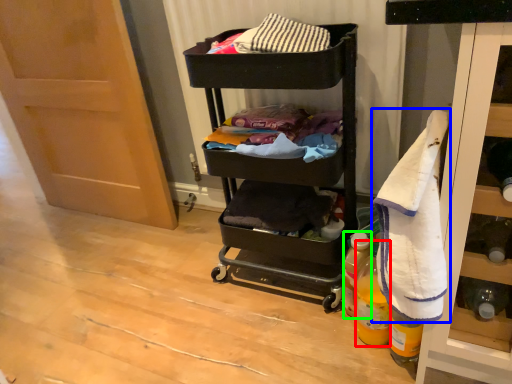
Question: Which object is the closest to the bottle (highlighted by a red box)? Choose among these: bath towel (highlighted by a blue box) or bottle (highlighted by a green box).

Choices:
 (A) bath towel
 (B) bottle

Answer: (B)